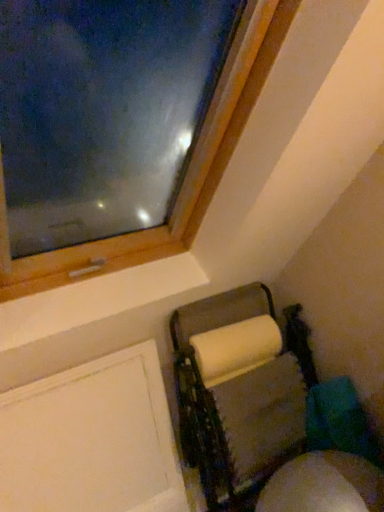
The image size is (384, 512). Find the location of `free spot above white matte screen door at lower left (from a real-world perspective)`. free spot above white matte screen door at lower left (from a real-world perspective) is located at coordinates (67, 365).